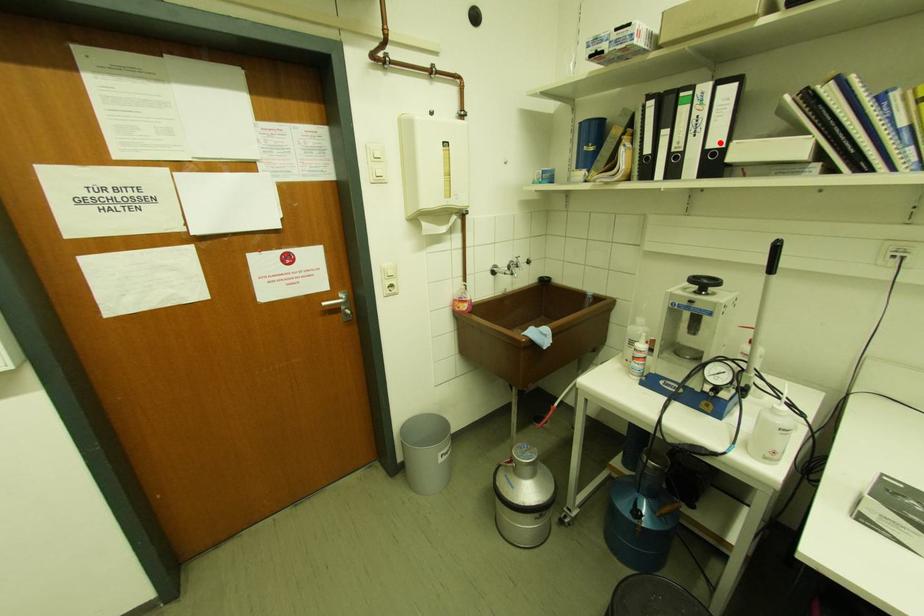
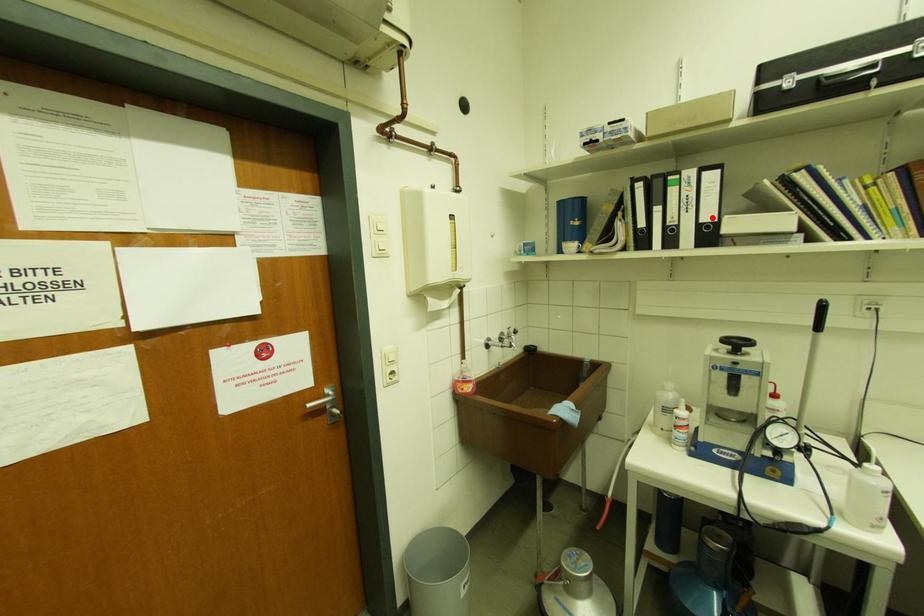
I am providing you with two images of the same scene from different viewpoints. A red point is marked on the first image and another point is marked on the second image. Are the points marked in image1 and image2 representing the same 3D position?

Yes